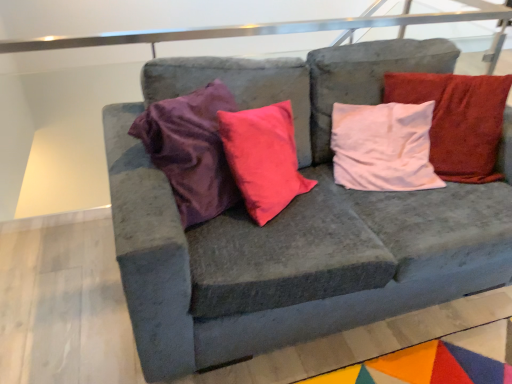
Question: Does white soft pillow at upper right have a greater height compared to multicolored felt mat at lower right?

Choices:
 (A) no
 (B) yes

Answer: (B)

Question: From a real-world perspective, does white soft pillow at upper right stand above multicolored felt mat at lower right?

Choices:
 (A) yes
 (B) no

Answer: (A)

Question: Is the position of white soft pillow at upper right less distant than that of multicolored felt mat at lower right?

Choices:
 (A) yes
 (B) no

Answer: (B)

Question: Is white soft pillow at upper right positioned with its back to multicolored felt mat at lower right?

Choices:
 (A) no
 (B) yes

Answer: (A)

Question: From the image's perspective, is white soft pillow at upper right below multicolored felt mat at lower right?

Choices:
 (A) yes
 (B) no

Answer: (B)

Question: Considering the positions of white soft pillow at upper right and velvet gray couch at center in the image, is white soft pillow at upper right wider or thinner than velvet gray couch at center?

Choices:
 (A) wide
 (B) thin

Answer: (B)

Question: Visually, is white soft pillow at upper right positioned to the left or to the right of velvet gray couch at center?

Choices:
 (A) right
 (B) left

Answer: (A)

Question: Is white soft pillow at upper right inside or outside of velvet gray couch at center?

Choices:
 (A) outside
 (B) inside

Answer: (B)

Question: From the image's perspective, is white soft pillow at upper right positioned above or below velvet gray couch at center?

Choices:
 (A) above
 (B) below

Answer: (A)

Question: Relative to white soft pillow at upper right, is velvet gray couch at center in front or behind?

Choices:
 (A) front
 (B) behind

Answer: (A)

Question: Visually, is velvet gray couch at center positioned to the left or to the right of white soft pillow at upper right?

Choices:
 (A) left
 (B) right

Answer: (A)

Question: Does point (368, 44) appear closer or farther from the camera than point (481, 139)?

Choices:
 (A) closer
 (B) farther

Answer: (B)

Question: From their relative heights in the image, would you say velvet gray couch at center is taller or shorter than white soft pillow at upper right?

Choices:
 (A) short
 (B) tall

Answer: (B)

Question: From the image's perspective, is velvet gray couch at center located above or below multicolored felt mat at lower right?

Choices:
 (A) above
 (B) below

Answer: (A)

Question: Considering the positions of velvet gray couch at center and multicolored felt mat at lower right in the image, is velvet gray couch at center taller or shorter than multicolored felt mat at lower right?

Choices:
 (A) tall
 (B) short

Answer: (A)